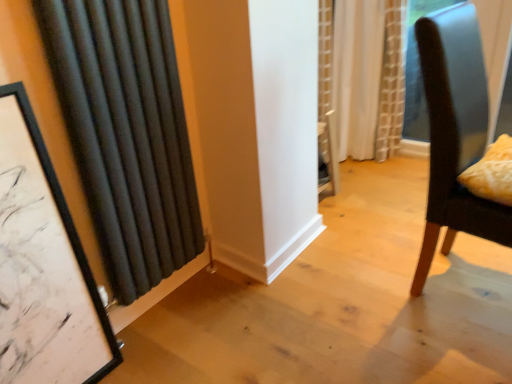
Describe the element at coordinates (127, 134) in the screenshot. I see `black fabric curtain at left, which ranks as the first curtain in left-to-right order` at that location.

Describe the element at coordinates (368, 77) in the screenshot. The height and width of the screenshot is (384, 512). I see `white textured curtain at center, acting as the second curtain starting from the front` at that location.

At what (x,y) coordinates should I click in order to perform the action: click on dark brown leather chair at right. Please return your answer as a coordinate pair (x, y). The width and height of the screenshot is (512, 384). Looking at the image, I should click on (455, 133).

Is yellow textured pillow at right wider or thinner than black fabric curtain at left, which ranks as the first curtain in left-to-right order?

yellow textured pillow at right is wider than black fabric curtain at left, which ranks as the first curtain in left-to-right order.

Which is behind, yellow textured pillow at right or black fabric curtain at left, which ranks as the second curtain in back-to-front order?

Positioned behind is yellow textured pillow at right.

Which object is positioned more to the right, yellow textured pillow at right or black fabric curtain at left, which ranks as the first curtain in left-to-right order?

Positioned to the right is yellow textured pillow at right.

Is black fabric curtain at left, placed as the 2th curtain when sorted from right to left, further to camera compared to dark brown leather chair at right?

Yes, black fabric curtain at left, placed as the 2th curtain when sorted from right to left, is behind dark brown leather chair at right.

Does point (143, 92) come farther from viewer compared to point (457, 123)?

Yes, it is.

The image size is (512, 384). Identify the location of chair on the right of black fabric curtain at left, placed as the 2th curtain when sorted from right to left. (455, 133).

Is white textured curtain at center, acting as the second curtain starting from the front, positioned beyond the bounds of black fabric curtain at left, acting as the 1th curtain starting from the front?

white textured curtain at center, acting as the second curtain starting from the front, is positioned outside black fabric curtain at left, acting as the 1th curtain starting from the front.

From the image's perspective, between white textured curtain at center, which is the 1th curtain in back-to-front order, and black fabric curtain at left, which ranks as the first curtain in left-to-right order, who is located below?

black fabric curtain at left, which ranks as the first curtain in left-to-right order.

This screenshot has height=384, width=512. Find the location of `curtain on the right of black fabric curtain at left, which ranks as the first curtain in left-to-right order`. curtain on the right of black fabric curtain at left, which ranks as the first curtain in left-to-right order is located at coordinates (368, 77).

Based on the photo, is white textured curtain at center, positioned as the second curtain in left-to-right order, turned away from black fabric curtain at left, which ranks as the second curtain in back-to-front order?

white textured curtain at center, positioned as the second curtain in left-to-right order, is not turned away from black fabric curtain at left, which ranks as the second curtain in back-to-front order.

In terms of size, does black fabric curtain at left, acting as the 1th curtain starting from the front, appear bigger or smaller than yellow textured pillow at right?

In the image, black fabric curtain at left, acting as the 1th curtain starting from the front, appears to be larger than yellow textured pillow at right.

Does black fabric curtain at left, acting as the 1th curtain starting from the front, have a greater width compared to yellow textured pillow at right?

In fact, black fabric curtain at left, acting as the 1th curtain starting from the front, might be narrower than yellow textured pillow at right.

Which is more to the right, matte black picture frame at left or dark brown leather chair at right?

Positioned to the right is dark brown leather chair at right.

Is matte black picture frame at left positioned with its back to dark brown leather chair at right?

No, matte black picture frame at left is not facing the opposite direction of dark brown leather chair at right.

From a real-world perspective, is matte black picture frame at left on top of dark brown leather chair at right?

Incorrect, from a real-world perspective, matte black picture frame at left is lower than dark brown leather chair at right.

Is matte black picture frame at left looking in the opposite direction of yellow textured pillow at right?

matte black picture frame at left does not have its back to yellow textured pillow at right.

Is matte black picture frame at left positioned far away from yellow textured pillow at right?

matte black picture frame at left is positioned a significant distance from yellow textured pillow at right.

Where is `pillow above the matte black picture frame at left (from a real-world perspective)`? pillow above the matte black picture frame at left (from a real-world perspective) is located at coordinates (492, 173).

From a real-world perspective, who is located lower, matte black picture frame at left or yellow textured pillow at right?

matte black picture frame at left, from a real-world perspective.

Which of these two, white textured curtain at center, which is the 1th curtain in back-to-front order, or matte black picture frame at left, stands taller?

matte black picture frame at left.

Does white textured curtain at center, which is the 1th curtain from right to left, appear on the right side of matte black picture frame at left?

Indeed, white textured curtain at center, which is the 1th curtain from right to left, is positioned on the right side of matte black picture frame at left.

From a real-world perspective, is white textured curtain at center, which is the 1th curtain from right to left, under matte black picture frame at left?

No, from a real-world perspective, white textured curtain at center, which is the 1th curtain from right to left, is not under matte black picture frame at left.

Where is `the 2nd curtain positioned above the matte black picture frame at left (from the image's perspective)`? This screenshot has width=512, height=384. the 2nd curtain positioned above the matte black picture frame at left (from the image's perspective) is located at coordinates (368, 77).

This screenshot has height=384, width=512. Identify the location of pillow below the black fabric curtain at left, which ranks as the second curtain in back-to-front order (from the image's perspective). (492, 173).

Where is `chair below the black fabric curtain at left, which ranks as the first curtain in left-to-right order (from a real-world perspective)`? This screenshot has width=512, height=384. chair below the black fabric curtain at left, which ranks as the first curtain in left-to-right order (from a real-world perspective) is located at coordinates (455, 133).

Estimate the real-world distances between objects in this image. Which object is further from black fabric curtain at left, which ranks as the second curtain in back-to-front order, white textured curtain at center, which is the 1th curtain from right to left, or dark brown leather chair at right?

Based on the image, white textured curtain at center, which is the 1th curtain from right to left, appears to be further to black fabric curtain at left, which ranks as the second curtain in back-to-front order.

Estimate the real-world distances between objects in this image. Which object is closer to yellow textured pillow at right, dark brown leather chair at right or white textured curtain at center, positioned as the second curtain in left-to-right order?

dark brown leather chair at right lies closer to yellow textured pillow at right than the other object.

Based on their spatial positions, is yellow textured pillow at right or matte black picture frame at left closer to white textured curtain at center, which is the 1th curtain from right to left?

The object closer to white textured curtain at center, which is the 1th curtain from right to left, is yellow textured pillow at right.

Which object lies nearer to the anchor point white textured curtain at center, which is the 1th curtain from right to left, dark brown leather chair at right or yellow textured pillow at right?

Among the two, dark brown leather chair at right is located nearer to white textured curtain at center, which is the 1th curtain from right to left.

Considering their positions, is dark brown leather chair at right positioned closer to black fabric curtain at left, which ranks as the first curtain in left-to-right order, than white textured curtain at center, positioned as the second curtain in left-to-right order?

The object closer to black fabric curtain at left, which ranks as the first curtain in left-to-right order, is dark brown leather chair at right.

From the image, which object appears to be farther from yellow textured pillow at right, white textured curtain at center, positioned as the second curtain in left-to-right order, or dark brown leather chair at right?

Among the two, white textured curtain at center, positioned as the second curtain in left-to-right order, is located further to yellow textured pillow at right.

Which object lies further to the anchor point white textured curtain at center, acting as the second curtain starting from the front, yellow textured pillow at right or black fabric curtain at left, placed as the 2th curtain when sorted from right to left?

black fabric curtain at left, placed as the 2th curtain when sorted from right to left, lies further to white textured curtain at center, acting as the second curtain starting from the front, than the other object.

Considering their positions, is black fabric curtain at left, placed as the 2th curtain when sorted from right to left, positioned further to white textured curtain at center, which is the 1th curtain from right to left, than matte black picture frame at left?

Based on the image, matte black picture frame at left appears to be further to white textured curtain at center, which is the 1th curtain from right to left.

Where is `curtain located between black fabric curtain at left, acting as the 1th curtain starting from the front, and yellow textured pillow at right in the left-right direction`? This screenshot has width=512, height=384. curtain located between black fabric curtain at left, acting as the 1th curtain starting from the front, and yellow textured pillow at right in the left-right direction is located at coordinates (368, 77).

Where is `pillow between dark brown leather chair at right and white textured curtain at center, acting as the second curtain starting from the front, in the front-back direction`? This screenshot has height=384, width=512. pillow between dark brown leather chair at right and white textured curtain at center, acting as the second curtain starting from the front, in the front-back direction is located at coordinates (492, 173).

At what (x,y) coordinates should I click in order to perform the action: click on chair between black fabric curtain at left, placed as the 2th curtain when sorted from right to left, and yellow textured pillow at right, in the horizontal direction. Please return your answer as a coordinate pair (x, y). Looking at the image, I should click on (455, 133).

This screenshot has height=384, width=512. What are the coordinates of `curtain located between matte black picture frame at left and white textured curtain at center, which is the 1th curtain from right to left, in the depth direction` in the screenshot? It's located at (127, 134).